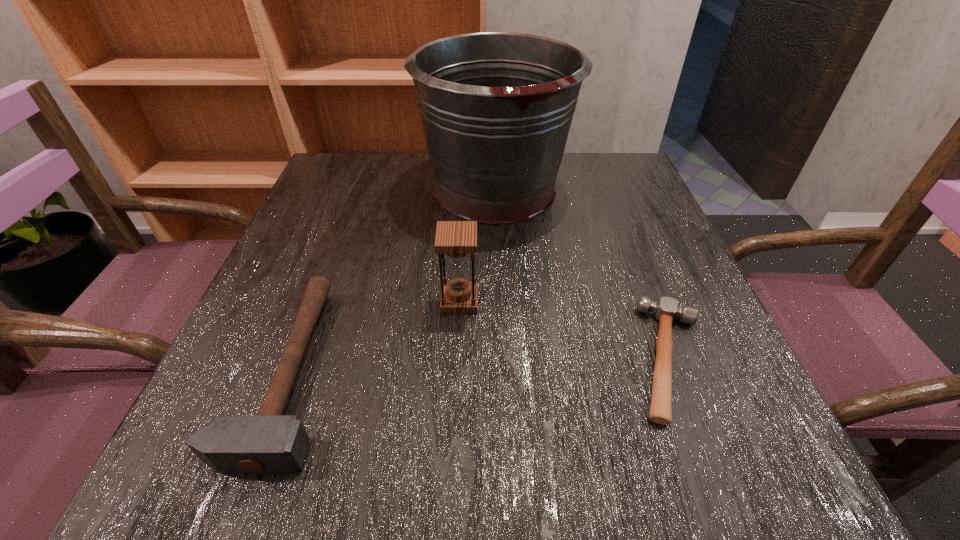
Locate an element on the screen. This screenshot has width=960, height=540. vacant region between the hourglass and the bucket is located at coordinates (477, 245).

Find the location of a particular element. The height and width of the screenshot is (540, 960). unoccupied area between the left hammer and the second tallest object is located at coordinates (373, 335).

Locate which object ranks third in proximity to the rightmost object. Please provide its 2D coordinates. Your answer should be formatted as a tuple, i.e. [(x, y)], where the tuple contains the x and y coordinates of a point satisfying the conditions above.

[(268, 443)]

You are a GUI agent. You are given a task and a screenshot of the screen. Output one action in this format:
    pyautogui.click(x=<x>, y=<y>)
    Task: Click on the object that stands as the third closest to the rightmost object
    This screenshot has width=960, height=540.
    Given the screenshot: What is the action you would take?
    (268, 443)

The height and width of the screenshot is (540, 960). I want to click on vacant space that satisfies the following two spatial constraints: 1. on the front side of the shorter hammer; 2. on the right side of the third shortest object, so click(456, 359).

This screenshot has height=540, width=960. I want to click on free spot that satisfies the following two spatial constraints: 1. on the front side of the right hammer; 2. on the right side of the bucket, so click(503, 359).

The height and width of the screenshot is (540, 960). I want to click on blank space that satisfies the following two spatial constraints: 1. on the front side of the second tallest object; 2. on the left side of the right hammer, so click(x=456, y=359).